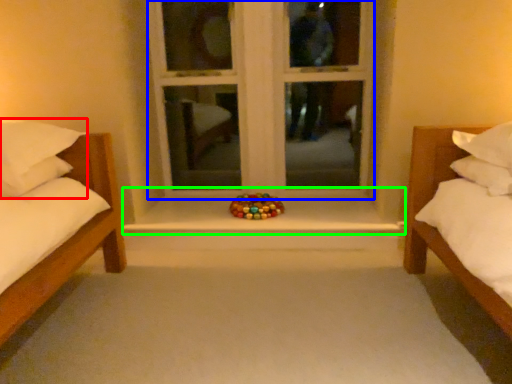
Question: Which object is the farthest from pillow (highlighted by a red box)? Choose among these: window frame (highlighted by a blue box) or window sill (highlighted by a green box).

Choices:
 (A) window frame
 (B) window sill

Answer: (A)